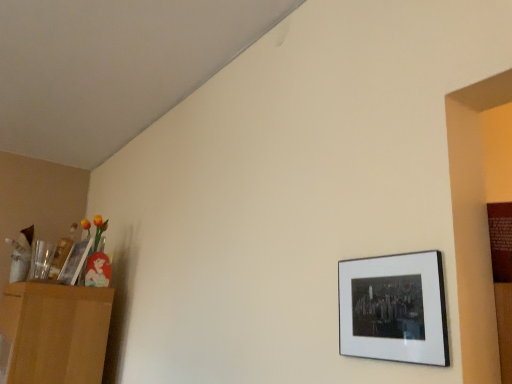
Question: Is wooden picture frame at left, positioned as the first picture frame in back-to-front order, wider than light brown wooden dresser at left?

Choices:
 (A) no
 (B) yes

Answer: (A)

Question: Is wooden picture frame at left, arranged as the 2th picture frame when viewed from the front, outside light brown wooden dresser at left?

Choices:
 (A) no
 (B) yes

Answer: (B)

Question: Is wooden picture frame at left, which ranks as the 1th picture frame in left-to-right order, positioned before light brown wooden dresser at left?

Choices:
 (A) yes
 (B) no

Answer: (B)

Question: Can you confirm if wooden picture frame at left, which ranks as the 1th picture frame in left-to-right order, is shorter than light brown wooden dresser at left?

Choices:
 (A) yes
 (B) no

Answer: (A)

Question: Are wooden picture frame at left, the 2th picture frame from the right, and light brown wooden dresser at left beside each other?

Choices:
 (A) no
 (B) yes

Answer: (A)

Question: Does point [72, 248] appear closer or farther from the camera than point [359, 316]?

Choices:
 (A) farther
 (B) closer

Answer: (A)

Question: Looking at the image, does wooden picture frame at left, positioned as the first picture frame in back-to-front order, seem bigger or smaller compared to matte black picture frame at lower right, marked as the 1th picture frame in a front-to-back arrangement?

Choices:
 (A) big
 (B) small

Answer: (A)

Question: From the image's perspective, is wooden picture frame at left, which ranks as the 1th picture frame in left-to-right order, above or below matte black picture frame at lower right, positioned as the 2th picture frame in left-to-right order?

Choices:
 (A) above
 (B) below

Answer: (B)

Question: Is wooden picture frame at left, arranged as the 2th picture frame when viewed from the front, spatially inside matte black picture frame at lower right, positioned as the 1th picture frame in right-to-left order, or outside of it?

Choices:
 (A) inside
 (B) outside

Answer: (B)

Question: Considering the relative positions of wooden picture frame at left, the 2th picture frame from the right, and light brown wooden dresser at left in the image provided, is wooden picture frame at left, the 2th picture frame from the right, to the left or to the right of light brown wooden dresser at left?

Choices:
 (A) left
 (B) right

Answer: (B)

Question: From a real-world perspective, is wooden picture frame at left, positioned as the first picture frame in back-to-front order, physically located above or below light brown wooden dresser at left?

Choices:
 (A) above
 (B) below

Answer: (A)

Question: Considering the positions of wooden picture frame at left, the 2th picture frame from the right, and light brown wooden dresser at left in the image, is wooden picture frame at left, the 2th picture frame from the right, wider or thinner than light brown wooden dresser at left?

Choices:
 (A) wide
 (B) thin

Answer: (B)

Question: In terms of size, does wooden picture frame at left, which ranks as the 1th picture frame in left-to-right order, appear bigger or smaller than light brown wooden dresser at left?

Choices:
 (A) small
 (B) big

Answer: (A)

Question: Is point (92, 294) positioned closer to the camera than point (338, 337)?

Choices:
 (A) closer
 (B) farther

Answer: (B)

Question: Is light brown wooden dresser at left inside the boundaries of matte black picture frame at lower right, the second picture frame when ordered from back to front, or outside?

Choices:
 (A) inside
 (B) outside

Answer: (B)